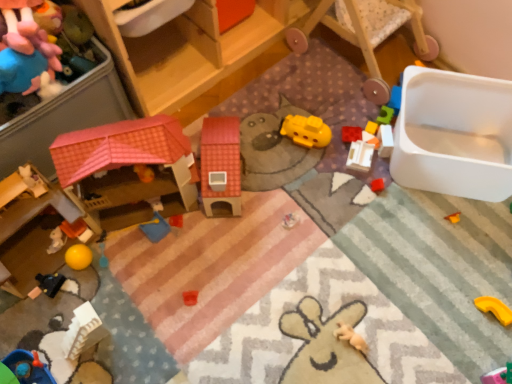
This screenshot has width=512, height=384. I want to click on free space that is in between yellow rubber toy at lower right, positioned as the 11th toy in left-to-right order, and matte plastic dollhouse at center-left, acting as the eighth toy starting from the right, so click(313, 246).